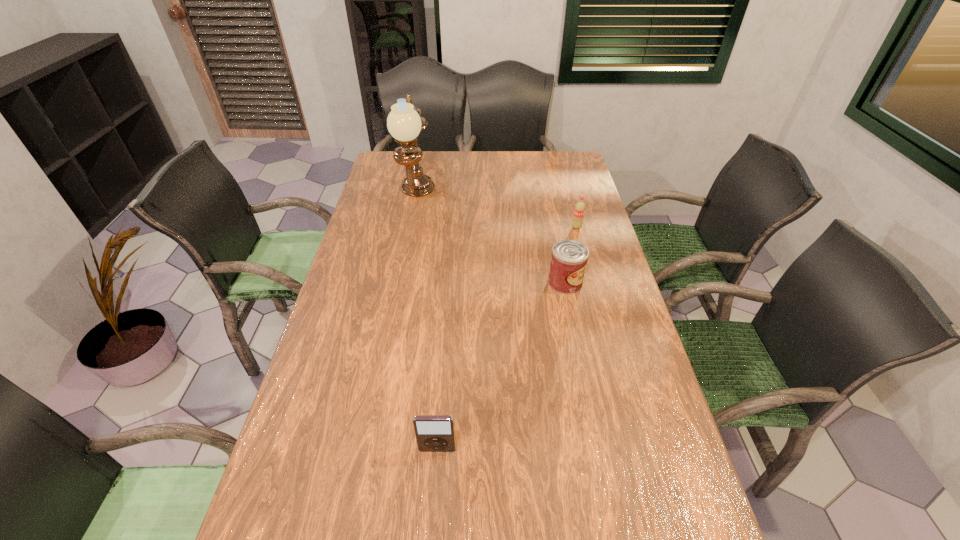
You are a GUI agent. You are given a task and a screenshot of the screen. Output one action in this format:
    pyautogui.click(x=<x>, y=<y>)
    Task: Click on the tallest object
    The height and width of the screenshot is (540, 960).
    Given the screenshot: What is the action you would take?
    pyautogui.click(x=404, y=122)

Where is `the leftmost object`? This screenshot has width=960, height=540. the leftmost object is located at coordinates (404, 122).

Where is `the third object from right to left`? This screenshot has height=540, width=960. the third object from right to left is located at coordinates (434, 433).

Find the location of a particular element. the nearest object is located at coordinates (434, 433).

At what (x,y) coordinates should I click in order to perform the action: click on the third object from left to right. Please return your answer as a coordinate pair (x, y). Looking at the image, I should click on (569, 257).

Locate an element on the screen. This screenshot has height=540, width=960. can is located at coordinates (569, 257).

I want to click on soda, so click(x=579, y=210).

Find the location of `the rightmost object`. the rightmost object is located at coordinates (579, 210).

Where is `free space located on the right of the farthest object`? The height and width of the screenshot is (540, 960). free space located on the right of the farthest object is located at coordinates (454, 198).

At what (x,y) coordinates should I click in order to perform the action: click on free space located 0.050m on the front-facing side of the second object from left to right. Please return your answer as a coordinate pair (x, y). Looking at the image, I should click on (436, 475).